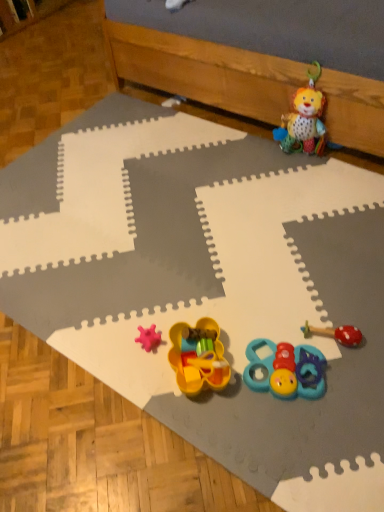
I want to click on unoccupied region to the right of yellow plastic toy at center, which appears as the 3th toy when viewed from the top, so pos(278,342).